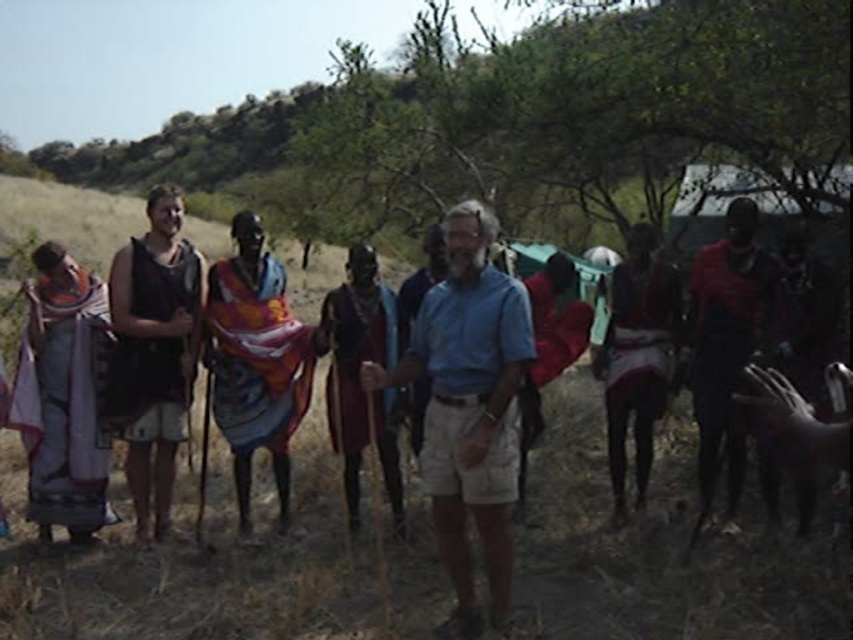
You are a photographer positioned at the origin of the coordinate system. You want to capture a photo of the blue cotton shirt at center. What are the coordinates you should aim your camera at?

The coordinates you should aim your camera at are point [469,406], which is where the blue cotton shirt at center is located.

You are standing at the origin of a coordinate system placed at the bottom left corner of the image. You need to walk to point A at point (138, 436) and point B at point (619, 436). Which point will you reach first?

You will reach point A at point (138, 436) first because it is in front of point B at point (619, 436).